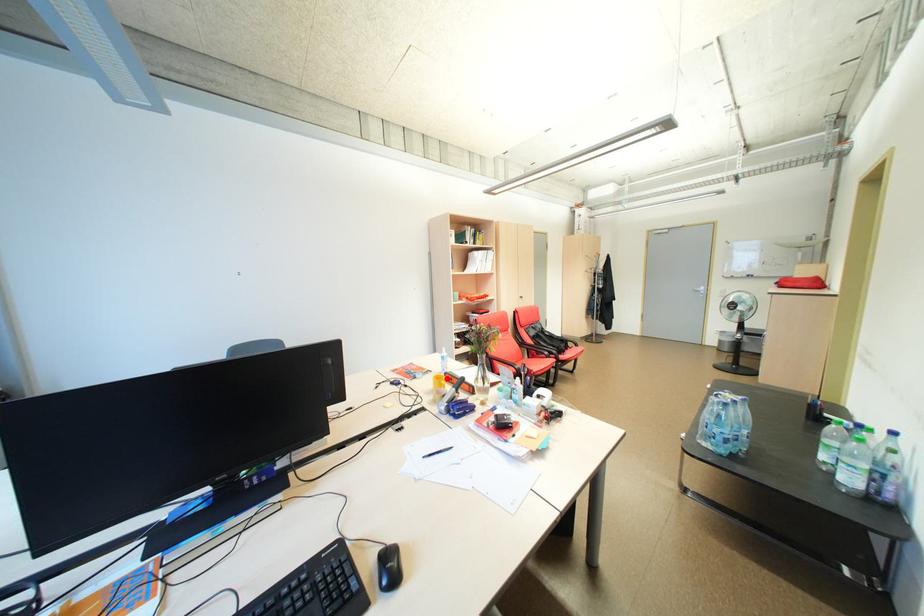
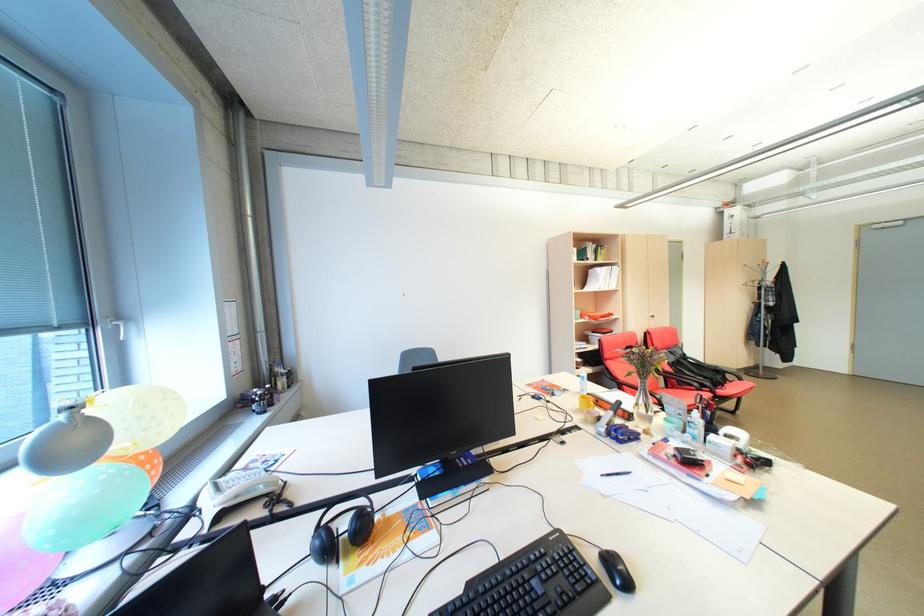
Question: A red point is marked in image1. In image2, is the corresponding 3D point closer to the camera or farther? Reply with the corresponding letter.

Choices:
 (A) The corresponding 3D point is closer.
 (B) The corresponding 3D point is farther.

Answer: (A)